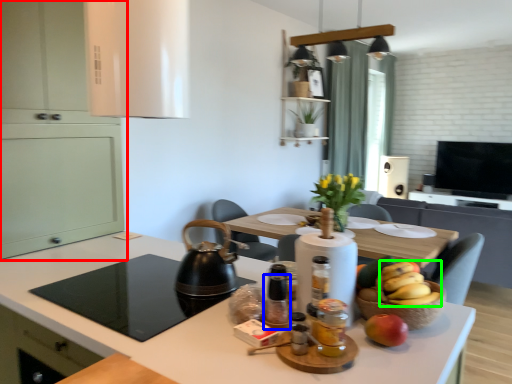
Question: Considering the real-world distances, which object is farthest from cabinetry (highlighted by a red box)? bottle (highlighted by a blue box) or banana (highlighted by a green box)?

Choices:
 (A) bottle
 (B) banana

Answer: (B)